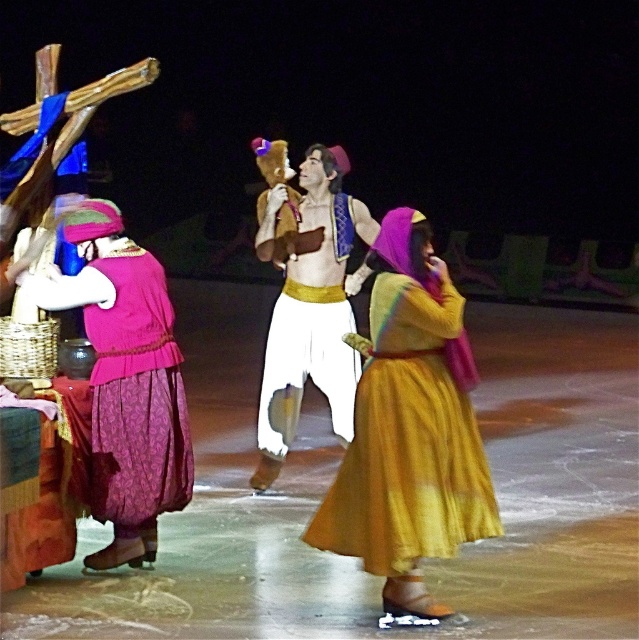
You are designing a stage layout for a performance and need to place two performers wearing the yellow satin dress at center and white satin pants at center. Given their clothing dimensions, which performer requires more horizontal space on the stage?

The yellow satin dress at center requires more horizontal space because its width is larger than that of the white satin pants at center.